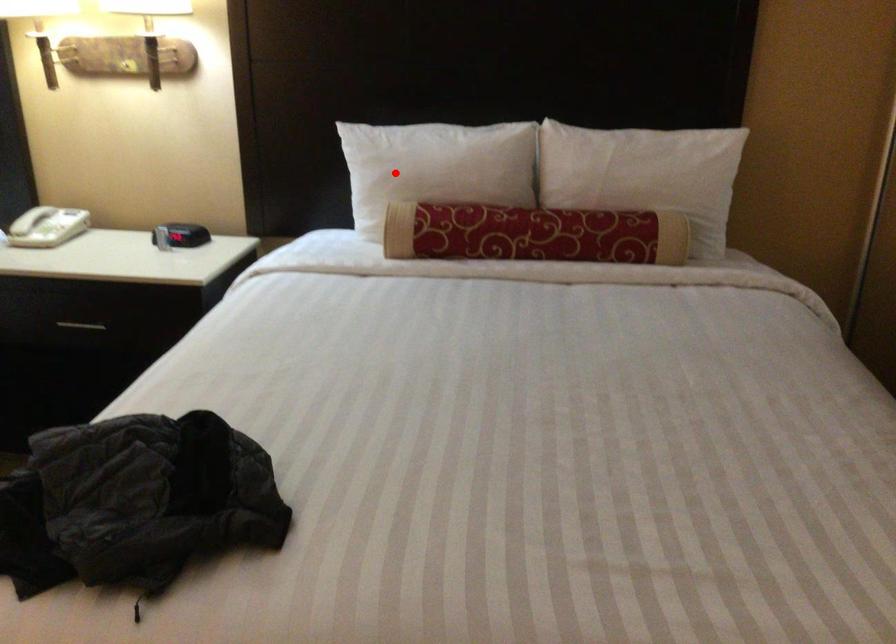
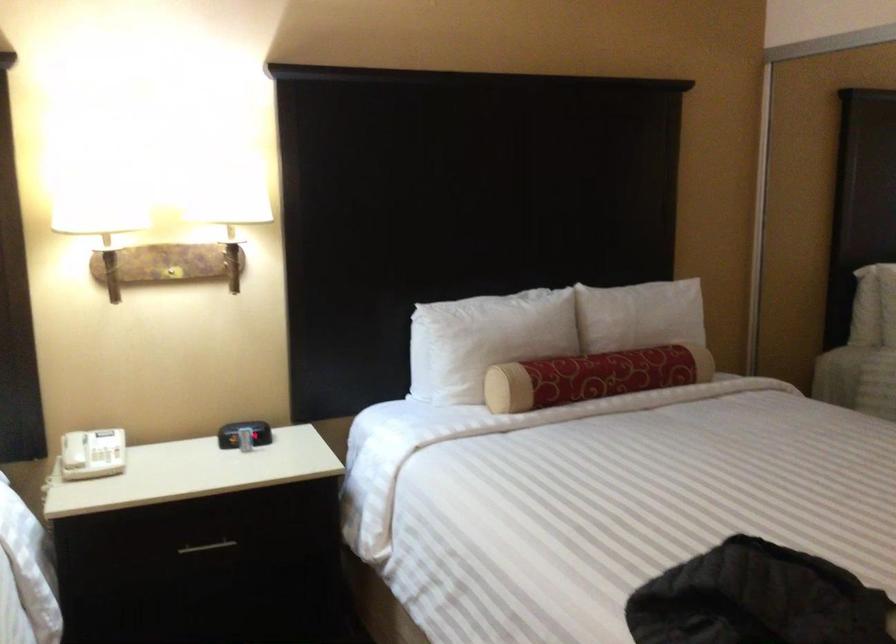
The point at the highlighted location is marked in the first image. Where is the corresponding point in the second image?

(485, 339)